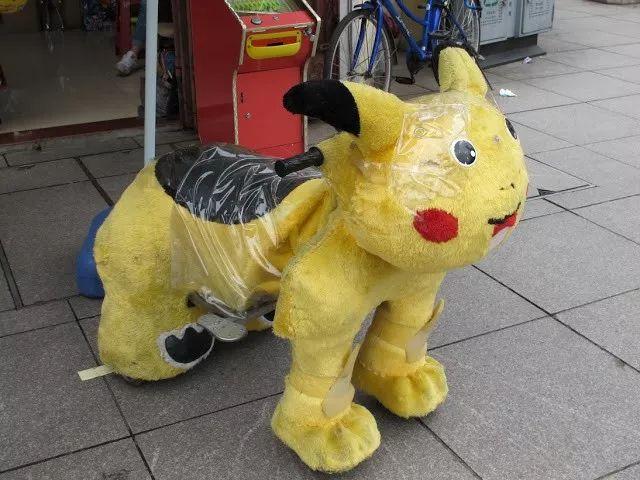
The width and height of the screenshot is (640, 480). In order to click on back fuzzy seat in this screenshot , I will do `click(227, 164)`.